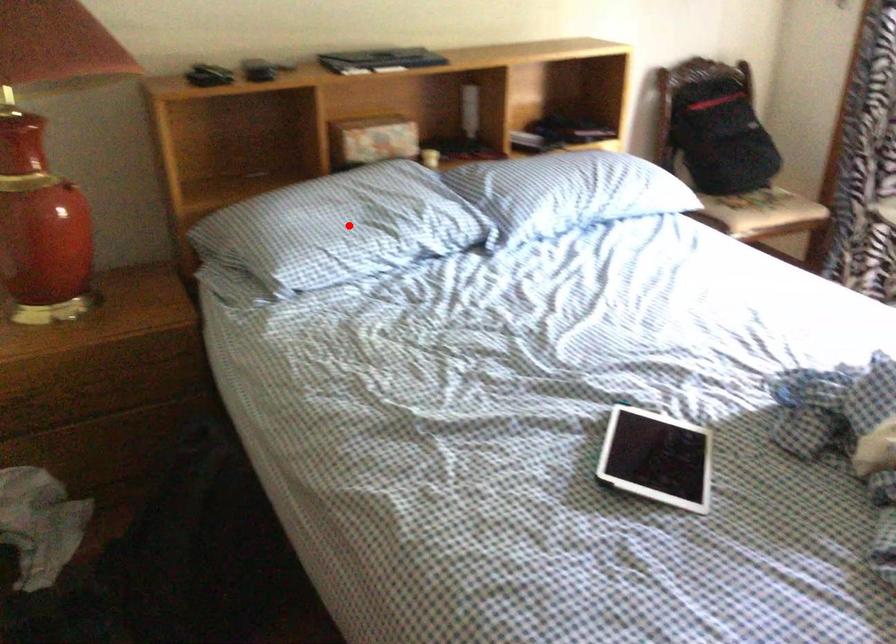
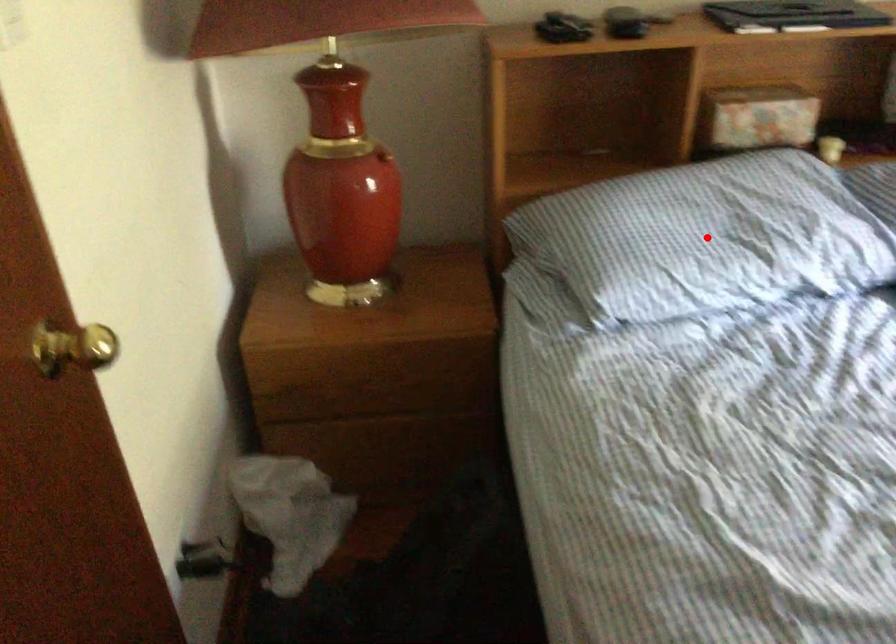
I am providing you with two images of the same scene from different viewpoints. A red point is marked on the first image and another point is marked on the second image. Does the point marked in image1 correspond to the same location as the one in image2?

Yes